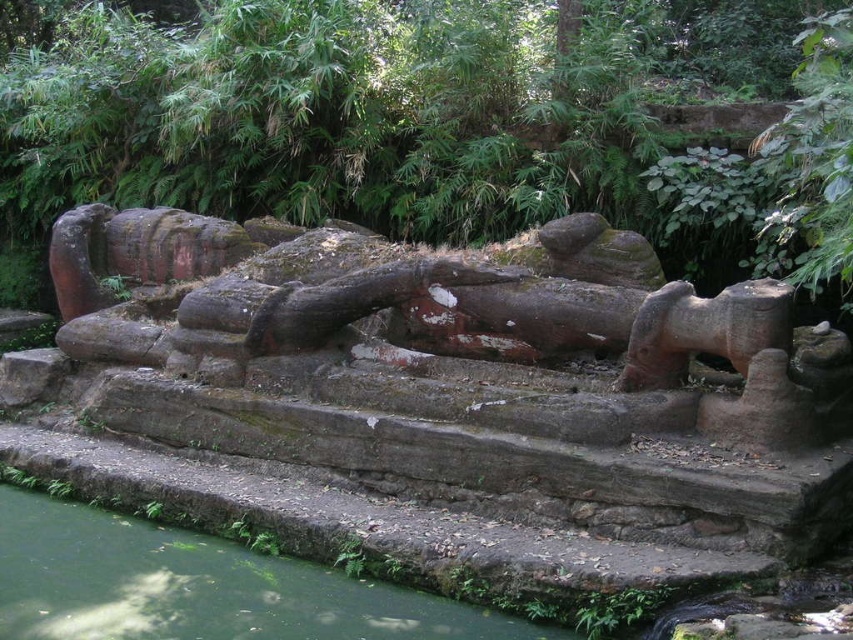
You are a landscape architect designing a garden path that must pass around the green mossy rock at center. Based on its position, which direction should the path curve to avoid it?

The green mossy rock at center is located at point coordinates that place it centrally in the scene, so the path should curve around it either to the left or right depending on the desired flow, but since it is centrally placed, a circular path might be appropriate to encircle the rock while maintaining accessibility.

You are a geologist examining the area around the large stone sculpture. You notice a specific point marked at coordinates (375, 108). What object is located at this point?

The green mossy rock at center is located at point (375, 108).

You are a landscape architect designing a garden. You need to place a new statue that requires a flat area larger than the space taken by the green mossy rock at center. Is there enough space available at the location of the green mossy water at lower left?

The green mossy rock at center occupies less space than the green mossy water at lower left, so the area at the location of the green mossy water at lower left has more space available. Therefore, there is enough space to place the new statue requiring a larger flat area than the green mossy rock at center.